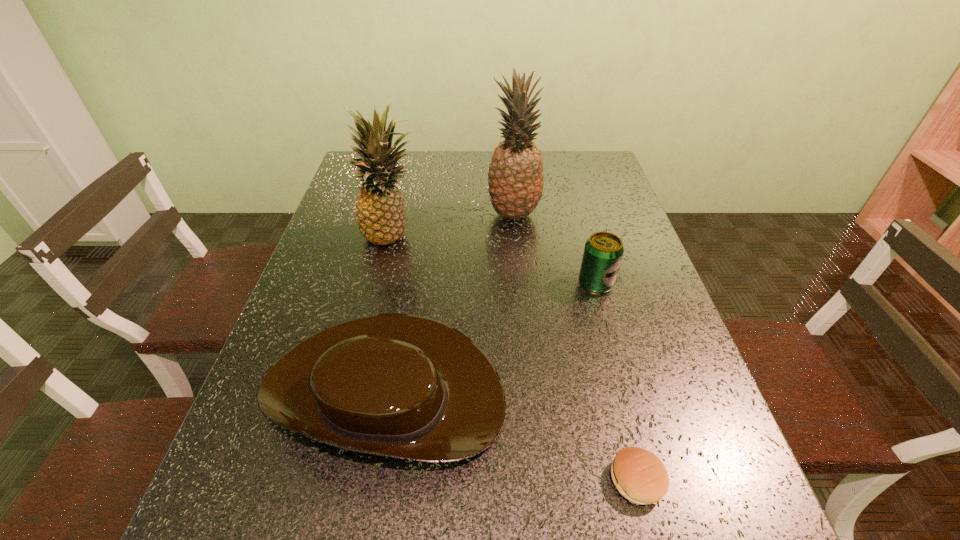
You are a GUI agent. You are given a task and a screenshot of the screen. Output one action in this format:
    pyautogui.click(x=<x>, y=<y>)
    Task: Click on the right pineapple
    
    Given the screenshot: What is the action you would take?
    pyautogui.click(x=515, y=181)

Locate an element on the screen. This screenshot has width=960, height=540. the left pineapple is located at coordinates (381, 217).

Image resolution: width=960 pixels, height=540 pixels. Identify the location of beer can. pos(603,252).

Locate an element on the screen. This screenshot has width=960, height=540. the third nearest object is located at coordinates (603, 252).

The image size is (960, 540). I want to click on the second shortest object, so click(404, 386).

Locate an element on the screen. the shortest object is located at coordinates (640, 476).

This screenshot has height=540, width=960. Find the location of `free location located on the left of the right pineapple`. free location located on the left of the right pineapple is located at coordinates (366, 215).

What are the coordinates of `vacant space positioned 0.170m on the right of the left pineapple` in the screenshot? It's located at (486, 235).

The width and height of the screenshot is (960, 540). Identify the location of vacant space located on the left of the third tallest object. pos(438,284).

At what (x,y) coordinates should I click in order to perform the action: click on vacant space located 0.350m on the right of the second shortest object. Please return your answer as a coordinate pair (x, y). Looking at the image, I should click on (686, 388).